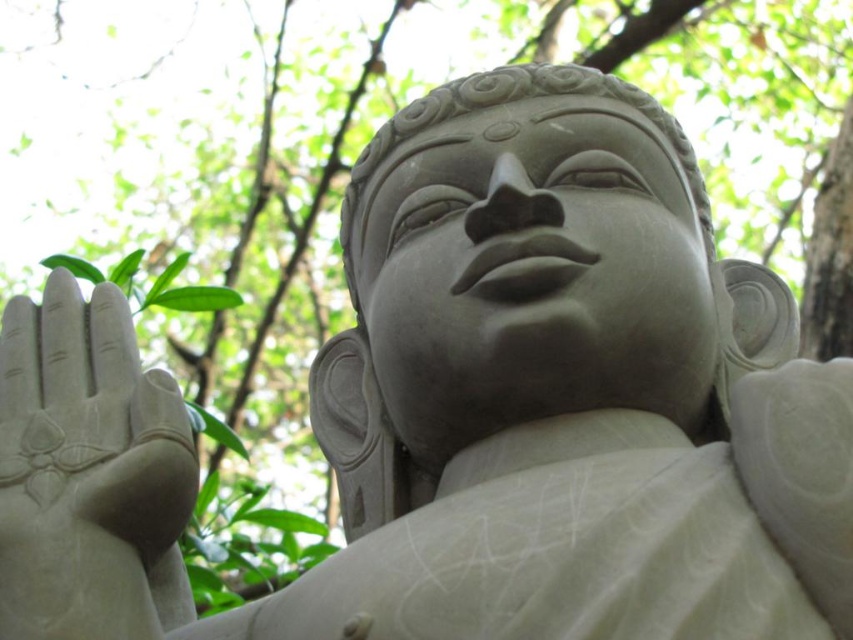
Question: Which point appears farthest from the camera in this image?

Choices:
 (A) coord(106,300)
 (B) coord(437,141)

Answer: (B)

Question: Can you confirm if smooth stone hand at left is positioned above gray stone statue at center?

Choices:
 (A) no
 (B) yes

Answer: (A)

Question: Where is smooth stone hand at left located in relation to gray stone statue at center in the image?

Choices:
 (A) right
 (B) left

Answer: (B)

Question: Among these points, which one is farthest from the camera?

Choices:
 (A) (85, 628)
 (B) (345, 204)

Answer: (B)

Question: Is smooth stone hand at left further to the viewer compared to gray stone statue at center?

Choices:
 (A) yes
 (B) no

Answer: (B)